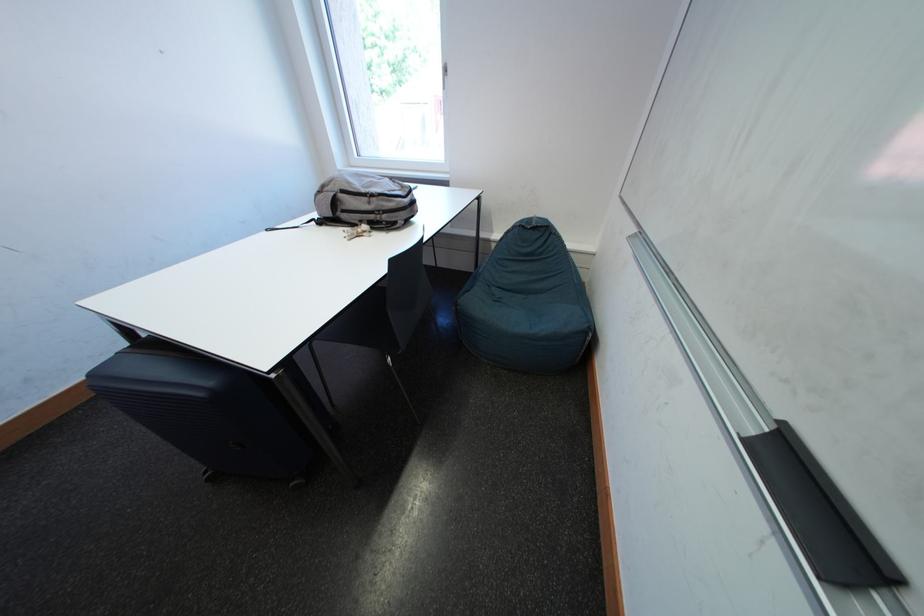
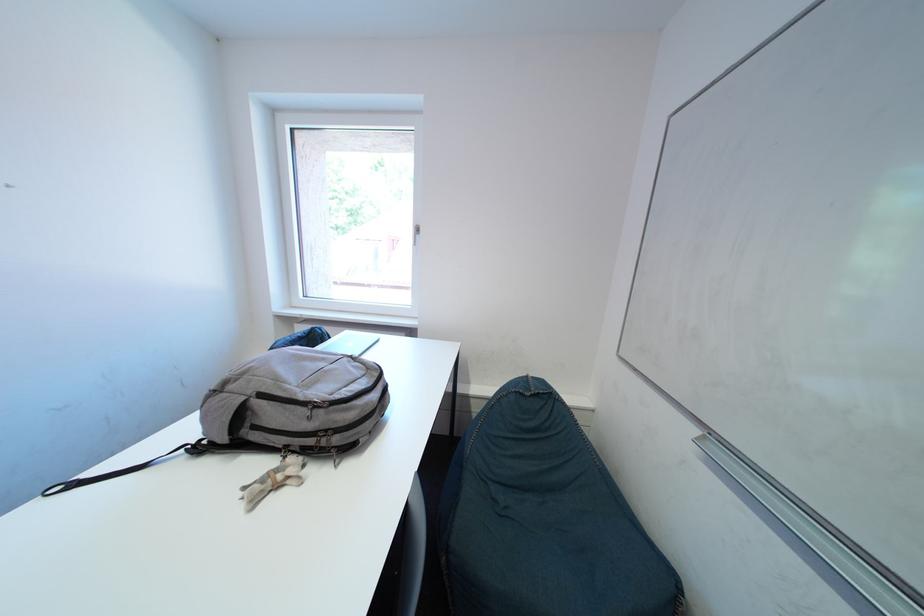
Question: The images are taken continuously from a first-person perspective. In which direction is your viewpoint rotating?

Choices:
 (A) Left
 (B) Right
 (C) Up
 (D) Down

Answer: (C)